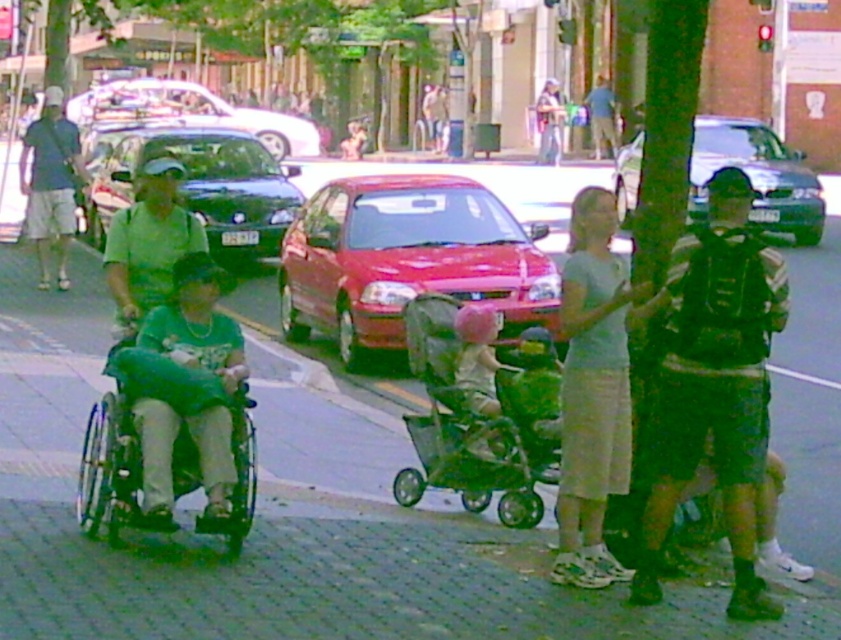
You are a delivery person who needs to deliver a package to the person wearing the dark blue shirt at left. The package is too large to carry while walking. You see the dark green backpack at right. Can you place the package in the backpack?

The dark green backpack at right is in front of the dark blue shirt at left, so you can place the package in the dark green backpack at right since it is accessible from your current position.

You are a delivery person who needs to place a package on the white glossy car at upper center. You are currently standing at the blue denim shirt at upper center. Can you reach the car without moving from your current position?

The white glossy car at upper center and blue denim shirt at upper center are 11.31 meters apart. Since the distance is too far, you cannot reach the car without moving from your current position.

What is the 2D coordinate of the shiny black sedan at center?

The shiny black sedan at center is located at the 2D coordinate point of (204,186).